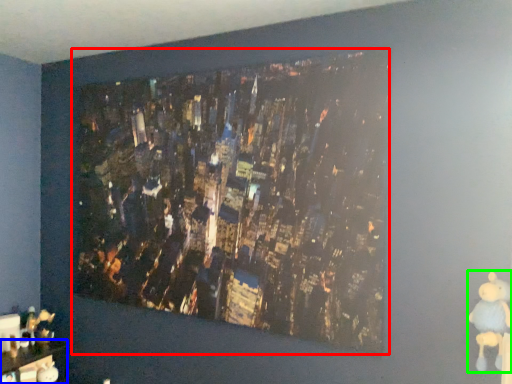
Question: Based on their relative distances, which object is farther from picture frame (highlighted by a red box)? Choose from furniture (highlighted by a blue box) and toy (highlighted by a green box).

Choices:
 (A) furniture
 (B) toy

Answer: (A)